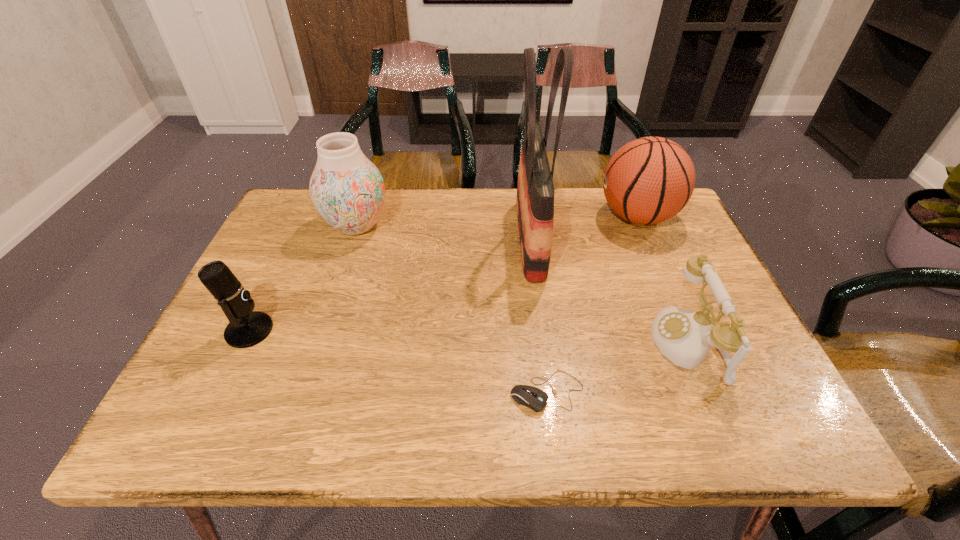
You are a GUI agent. You are given a task and a screenshot of the screen. Output one action in this format:
    pyautogui.click(x=<x>, y=<y>)
    Task: Click on the free region located 0.100m on the side where the inflation valve is located
    Image resolution: width=960 pixels, height=540 pixels.
    Given the screenshot: What is the action you would take?
    pyautogui.click(x=563, y=217)

Image resolution: width=960 pixels, height=540 pixels. In order to click on free space located 0.150m on the side where the inflation valve is located in this screenshot , I will do `click(545, 217)`.

You are a GUI agent. You are given a task and a screenshot of the screen. Output one action in this format:
    pyautogui.click(x=<x>, y=<y>)
    Task: Click on the free space located on the side where the inflation valve is located
    This screenshot has height=540, width=960.
    Given the screenshot: What is the action you would take?
    pyautogui.click(x=565, y=217)

At what (x,y) coordinates should I click in order to perform the action: click on vacant area situated on the back of the leftmost object. Please return your answer as a coordinate pair (x, y). The image size is (960, 540). Looking at the image, I should click on (289, 248).

This screenshot has height=540, width=960. I want to click on vacant position located on the dial of the telephone, so click(603, 345).

Identify the location of vacant position located on the dial of the telephone. The width and height of the screenshot is (960, 540). (608, 345).

Where is `free space located on the dial of the telephone`? The width and height of the screenshot is (960, 540). free space located on the dial of the telephone is located at coordinates (478, 345).

Identify the location of vacant space located on the back of the shortest object. This screenshot has width=960, height=540. (535, 296).

Locate an element on the screen. This screenshot has height=540, width=960. shopping bag positioned at the far edge is located at coordinates (535, 190).

This screenshot has width=960, height=540. What are the coordinates of `vase located in the far edge section of the desktop` in the screenshot? It's located at coord(347,189).